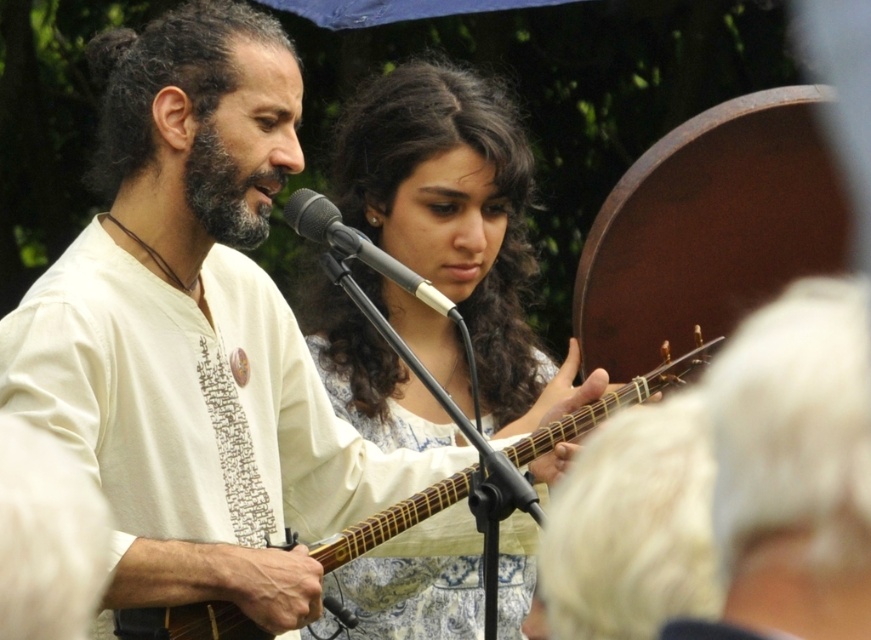
Question: Is wooden acoustic guitar at center bigger than bearddark brown/thickfacial hair at left?

Choices:
 (A) yes
 (B) no

Answer: (A)

Question: Which point appears farthest from the camera in this image?

Choices:
 (A) (447, 300)
 (B) (204, 157)

Answer: (B)

Question: Considering the relative positions of white woven shirt at center and light brown wood guitar at center in the image provided, where is white woven shirt at center located with respect to light brown wood guitar at center?

Choices:
 (A) right
 (B) left

Answer: (B)

Question: Is light brown wood guitar at center positioned before bearddark brown/thickfacial hair at left?

Choices:
 (A) no
 (B) yes

Answer: (A)

Question: Which point appears farthest from the camera in this image?

Choices:
 (A) (314, 208)
 (B) (65, 349)
 (C) (338, 548)
 (D) (230, 198)

Answer: (D)

Question: Which point is farther to the camera?

Choices:
 (A) (288, 204)
 (B) (140, 612)

Answer: (A)